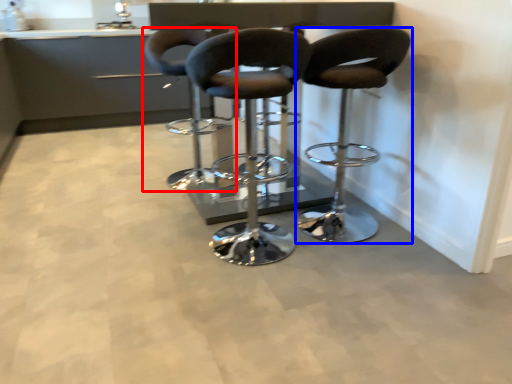
Question: Which of the following is the farthest to the observer, chair (highlighted by a red box) or chair (highlighted by a blue box)?

Choices:
 (A) chair
 (B) chair

Answer: (A)